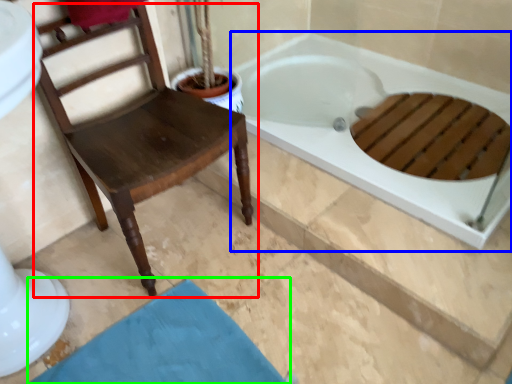
Question: Estimate the real-world distances between objects in this image. Which object is closer to chair (highlighted by a red box), bathtub (highlighted by a blue box) or bath mat (highlighted by a green box)?

Choices:
 (A) bathtub
 (B) bath mat

Answer: (B)